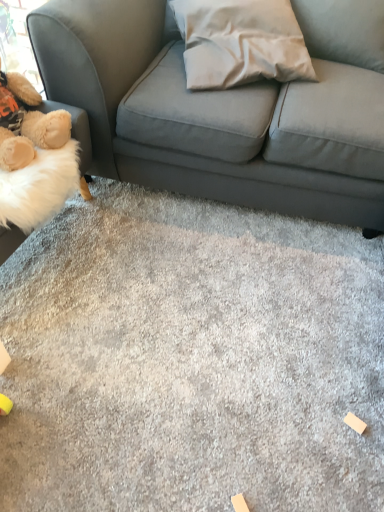
Question: Should I look upward or downward to see white fabric pillow at center?

Choices:
 (A) up
 (B) down

Answer: (A)

Question: Can you confirm if fluffy beige teddy bear at left is smaller than white fabric pillow at center?

Choices:
 (A) yes
 (B) no

Answer: (A)

Question: Is fluffy beige teddy bear at left next to white fabric pillow at center and touching it?

Choices:
 (A) yes
 (B) no

Answer: (B)

Question: From a real-world perspective, is fluffy beige teddy bear at left physically below white fabric pillow at center?

Choices:
 (A) yes
 (B) no

Answer: (A)

Question: Can you confirm if fluffy beige teddy bear at left is shorter than white fabric pillow at center?

Choices:
 (A) no
 (B) yes

Answer: (A)

Question: Can you confirm if fluffy beige teddy bear at left is taller than white fabric pillow at center?

Choices:
 (A) yes
 (B) no

Answer: (A)

Question: Can you confirm if fluffy beige teddy bear at left is wider than white fabric pillow at center?

Choices:
 (A) yes
 (B) no

Answer: (B)

Question: Does fluffy beige teddy bear at left appear on the left side of gray carpet at center?

Choices:
 (A) yes
 (B) no

Answer: (A)

Question: Considering the relative sizes of fluffy beige teddy bear at left and gray carpet at center in the image provided, is fluffy beige teddy bear at left smaller than gray carpet at center?

Choices:
 (A) yes
 (B) no

Answer: (A)

Question: Does fluffy beige teddy bear at left have a greater width compared to gray carpet at center?

Choices:
 (A) no
 (B) yes

Answer: (A)

Question: From a real-world perspective, is fluffy beige teddy bear at left on gray carpet at center?

Choices:
 (A) yes
 (B) no

Answer: (A)

Question: Can you confirm if fluffy beige teddy bear at left is taller than gray carpet at center?

Choices:
 (A) no
 (B) yes

Answer: (B)

Question: From a real-world perspective, does fluffy beige teddy bear at left sit lower than gray carpet at center?

Choices:
 (A) no
 (B) yes

Answer: (A)

Question: Does white fabric pillow at center have a lesser height compared to fluffy beige teddy bear at left?

Choices:
 (A) no
 (B) yes

Answer: (B)